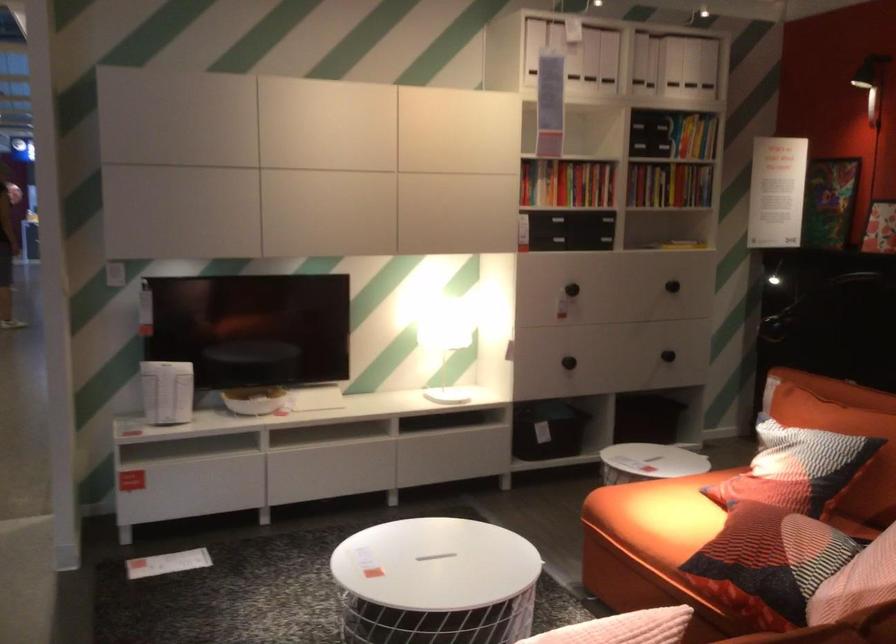
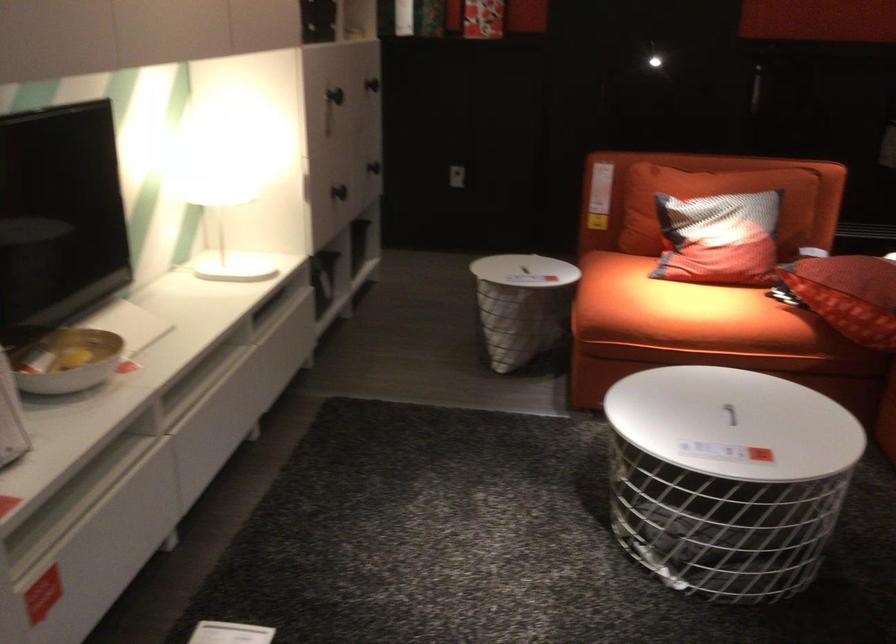
In the second image, find the point that corresponds to (685,339) in the first image.

(373, 167)